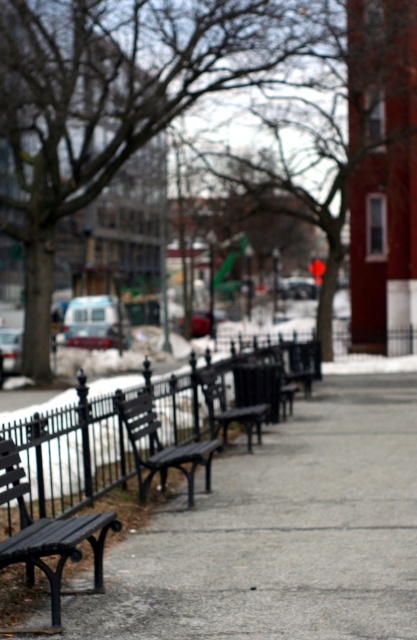
You are a delivery person trying to place a large package on the sidewalk between the matte black bench at lower left and the matte black bench at center. Considering their sizes, which bench would allow more space for the package?

The matte black bench at center occupies more space than the matte black bench at lower left, so placing the package next to the matte black bench at lower left would leave more space for the package.

You are standing at the origin point of the coordinate system in this urban scene. You need to walk to the smooth concrete sidewalk at center. What are the coordinates you should head towards?

The coordinates you should head towards are 0.834 in the x direction and 0.674 in the y direction.